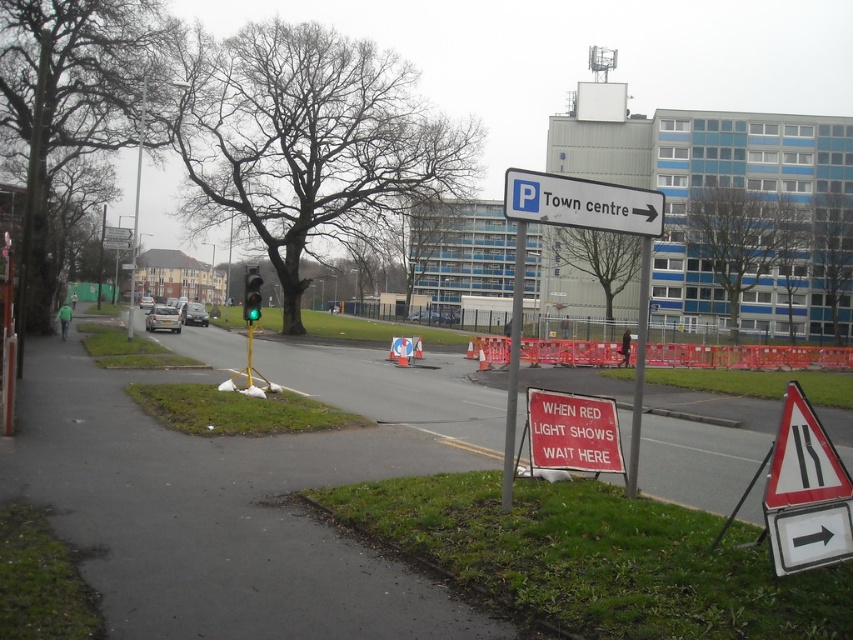
You are a delivery driver who needs to locate the black reflective triangle at lower right in the image. According to the scene, where exactly is it positioned?

The black reflective triangle at lower right is positioned at point (804, 458).

You are standing at the point with coordinates point [647,296] and want to walk towards the point with coordinates point [511,390]. According to the scene, will you be moving forward or backward relative to your current position?

Since point [511,390] is in front of point [647,296], you will be moving forward relative to your current position.

You are a delivery drone flying at an altitude of 50 meters above the urban scene. You need to drop a package at the black reflective triangle at lower right. Can you safely drop the package without hitting the green glass traffic light at center?

The distance between the black reflective triangle at lower right and the green glass traffic light at center is 24.94 meters. Since the drone is flying at 50 meters altitude, it can safely drop the package at the black reflective triangle at lower right without hitting the green glass traffic light at center as the horizontal distance is sufficient.